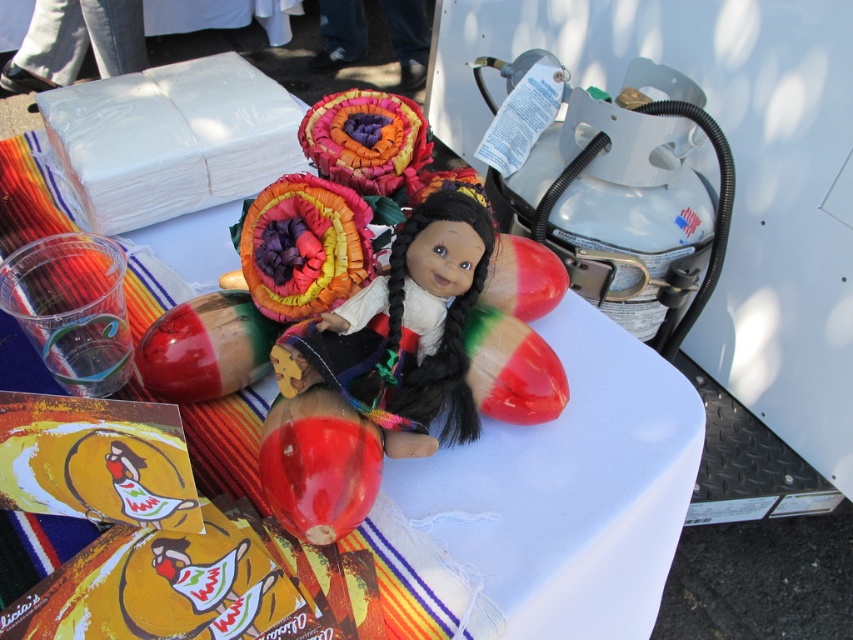
Which is more to the left, white glossy table at center or matte plastic doll at center?

white glossy table at center is more to the left.

Between white glossy table at center and matte plastic doll at center, which one has more height?

Standing taller between the two is white glossy table at center.

Is point (628, 620) positioned before point (358, 330)?

No, it is behind (358, 330).

The height and width of the screenshot is (640, 853). In order to click on white glossy table at center in this screenshot , I will do `click(567, 490)`.